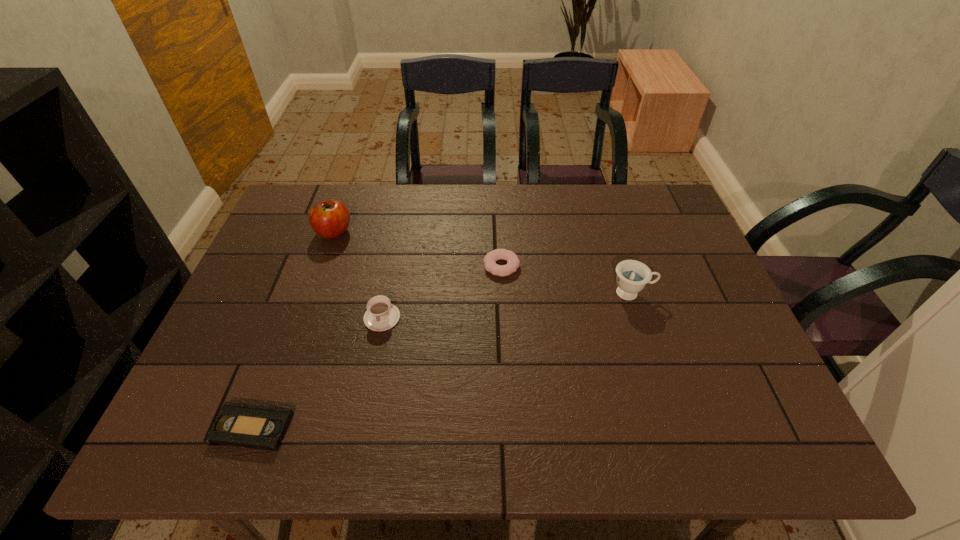
The image size is (960, 540). I want to click on vacant space located on the back of the apple, so click(346, 200).

Where is `vacant space situated 0.160m on the side of the rightmost object with the handle`? This screenshot has width=960, height=540. vacant space situated 0.160m on the side of the rightmost object with the handle is located at coordinates (714, 293).

I want to click on vacant area situated on the handle side of the left teacup, so click(x=368, y=391).

At what (x,y) coordinates should I click in order to perform the action: click on free space located on the left of the fourth object from left to right. Please return your answer as a coordinate pair (x, y). Image resolution: width=960 pixels, height=540 pixels. Looking at the image, I should click on (455, 266).

Find the location of a particular element. The width and height of the screenshot is (960, 540). vacant space located 0.390m on the back of the videotape is located at coordinates (310, 275).

Image resolution: width=960 pixels, height=540 pixels. I want to click on object located at the far edge, so click(x=329, y=219).

This screenshot has height=540, width=960. What are the coordinates of `object positioned at the near edge` in the screenshot? It's located at (243, 425).

This screenshot has height=540, width=960. Identify the location of apple present at the left edge. (329, 219).

The width and height of the screenshot is (960, 540). I want to click on videotape at the left edge, so click(243, 425).

Locate an element on the screen. The width and height of the screenshot is (960, 540). object situated at the far left corner is located at coordinates (329, 219).